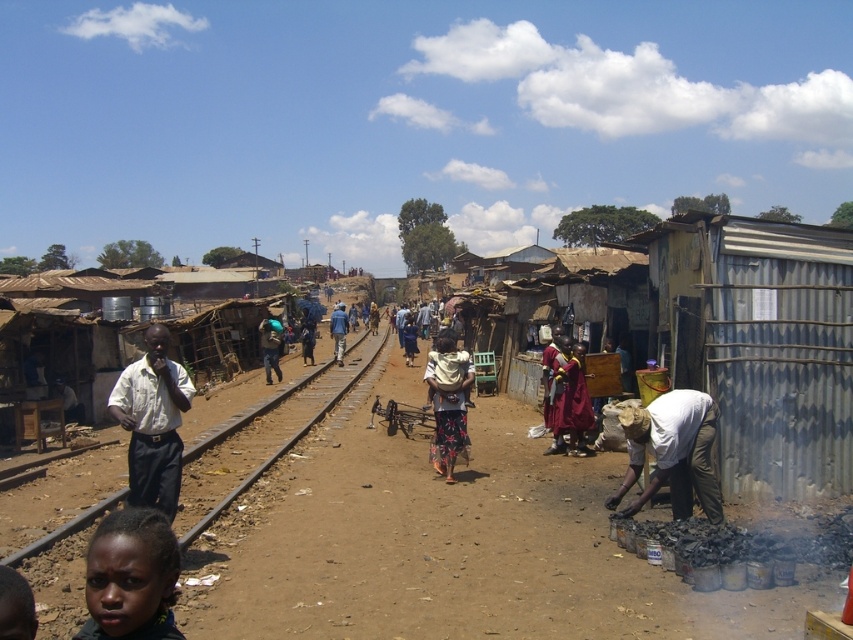
Question: Which object is farther from the camera taking this photo?

Choices:
 (A) floral fabric dress at center
 (B) dark blue shirt at center
 (C) white matte shirt at lower right

Answer: (B)

Question: Is white shirt at center to the left of white matte shirt at lower right from the viewer's perspective?

Choices:
 (A) yes
 (B) no

Answer: (A)

Question: Does white shirt at center come behind floral fabric dress at center?

Choices:
 (A) no
 (B) yes

Answer: (A)

Question: Is white shirt at center above floral fabric dress at center?

Choices:
 (A) yes
 (B) no

Answer: (B)

Question: Estimate the real-world distances between objects in this image. Which object is closer to the floral fabric dress at center?

Choices:
 (A) blue fabric at center
 (B) white matte shirt at lower right

Answer: (B)

Question: Which of the following is the farthest from the observer?

Choices:
 (A) (149, 576)
 (B) (677, 468)
 (C) (555, 384)
 (D) (444, 396)

Answer: (C)